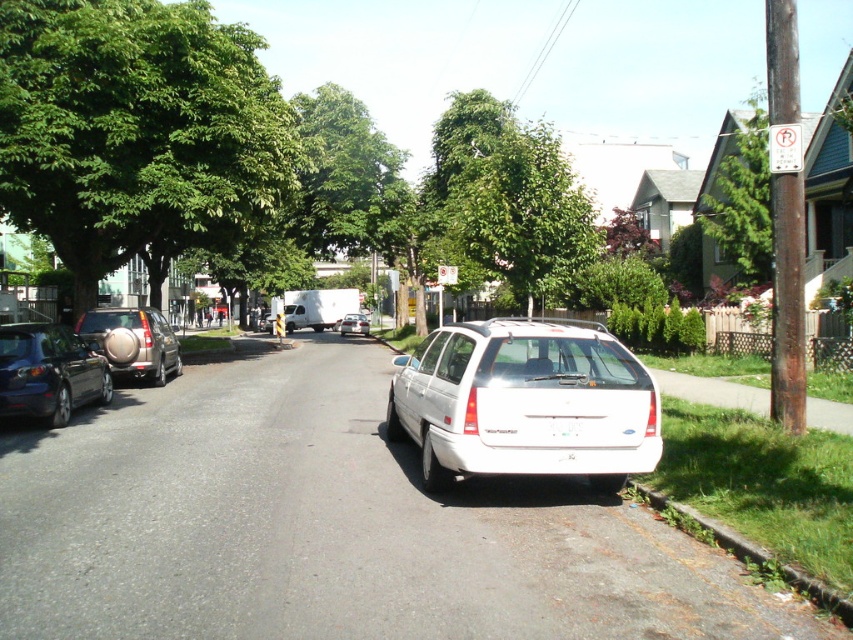
How much distance is there between white matte wagon at center and green grass at lower right?

white matte wagon at center and green grass at lower right are 11.76 feet apart.

Who is more forward, (x=514, y=426) or (x=781, y=566)?

Point (x=781, y=566)

At what (x,y) coordinates should I click in order to perform the action: click on white matte wagon at center. Please return your answer as a coordinate pair (x, y). The height and width of the screenshot is (640, 853). Looking at the image, I should click on (524, 403).

Which is below, green leafy tree at upper left or matte black sedan at left?

matte black sedan at left is lower down.

Does green leafy tree at upper left have a smaller size compared to matte black sedan at left?

Incorrect, green leafy tree at upper left is not smaller in size than matte black sedan at left.

Where is `green leafy tree at upper left`? Image resolution: width=853 pixels, height=640 pixels. green leafy tree at upper left is located at coordinates (134, 128).

The image size is (853, 640). I want to click on green leafy tree at upper left, so click(x=134, y=128).

Can you confirm if green textured tree at upper right is smaller than matte silver suv at left?

No.

Which of these two, green textured tree at upper right or matte silver suv at left, stands taller?

Standing taller between the two is green textured tree at upper right.

This screenshot has height=640, width=853. Identify the location of green textured tree at upper right. (738, 195).